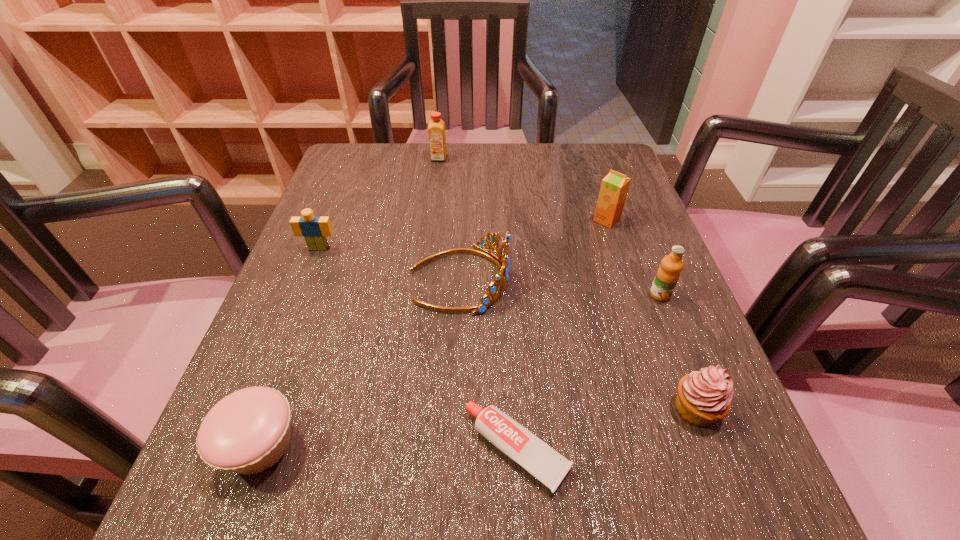
Locate an element on the screen. cupcake at the near edge is located at coordinates (x=248, y=431).

Identify the location of toothpaste present at the near edge. The width and height of the screenshot is (960, 540). (539, 459).

Locate an element on the screen. The image size is (960, 540). Lego that is at the left edge is located at coordinates (314, 229).

Identify the location of cupcake that is at the left edge. (248, 431).

Find the location of a particular element. cupcake positioned at the right edge is located at coordinates (704, 397).

Where is `object situated at the near left corner`? This screenshot has width=960, height=540. object situated at the near left corner is located at coordinates (248, 431).

The image size is (960, 540). In the image, there is a desktop. Find the location of `free region at the far edge`. free region at the far edge is located at coordinates (512, 179).

This screenshot has height=540, width=960. Identify the location of free space at the near edge. (404, 478).

In the image, there is a desktop. Where is `free space at the left edge`? Image resolution: width=960 pixels, height=540 pixels. free space at the left edge is located at coordinates (372, 245).

Identify the location of free space at the right edge of the desktop. (678, 321).